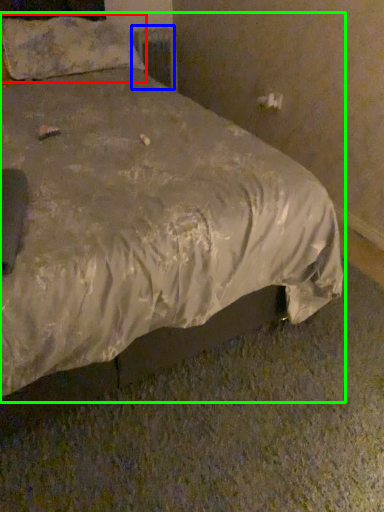
Question: Based on their relative distances, which object is nearer to pillow (highlighted by a red box)? Choose from radiator (highlighted by a blue box) and bed (highlighted by a green box).

Choices:
 (A) radiator
 (B) bed

Answer: (B)